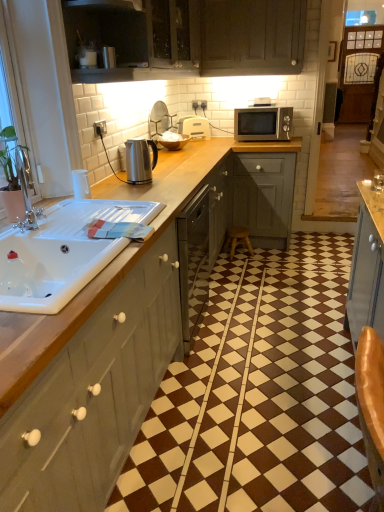
Locate an element on the screen. The image size is (384, 512). vacant area that lies to the right of wooden stool at center is located at coordinates (273, 253).